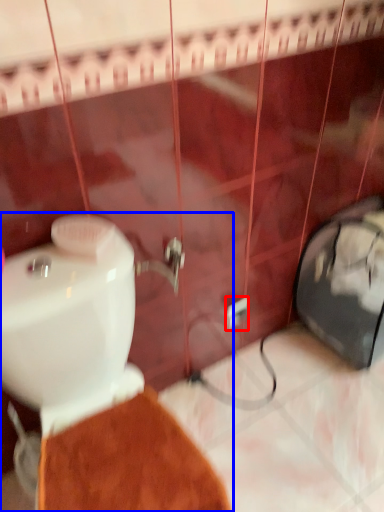
Question: Which object appears closest to the camera in this image, electric outlet (highlighted by a red box) or toilet (highlighted by a blue box)?

Choices:
 (A) electric outlet
 (B) toilet

Answer: (B)